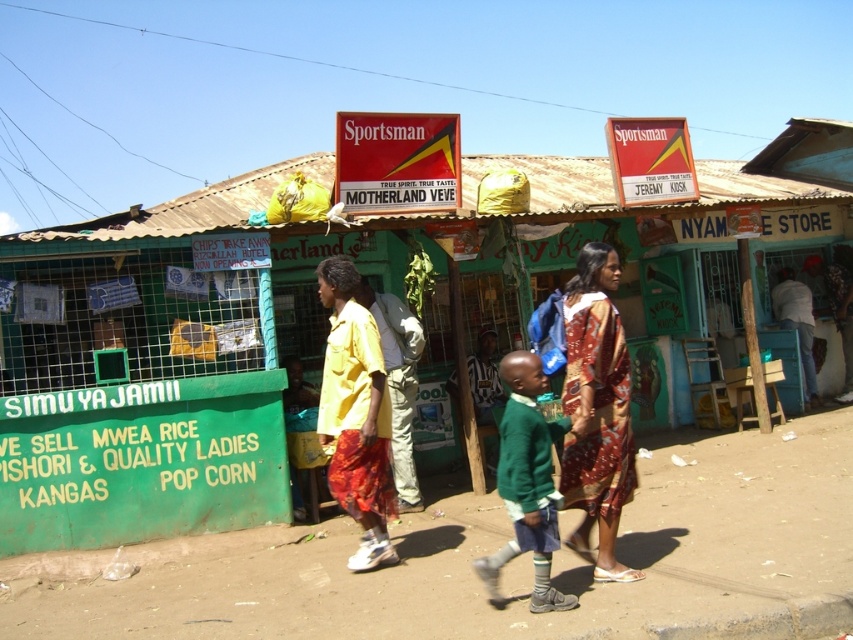
You are a photographer standing on the dirt road and want to take a photo of the printed silk dress at center and the green knitted sweater at center. Which object should you focus on first if you want to capture both in the same frame without moving the camera?

The printed silk dress at center is much taller than the green knitted sweater at center, so you should focus on the printed silk dress at center first to ensure it fits within the frame.

You are a photographer positioned on the dirt road. You want to take a photo of the green knitted sweater at center and the yellow fabric skirt at center. Which object should you focus on first to ensure both are in the frame?

The green knitted sweater at center is behind the yellow fabric skirt at center, so you should focus on the yellow fabric skirt at center first to ensure both are in the frame.

You are a tailor trying to fit a customer who prefers outfits with more fabric. Given the printed silk dress at center and the green knitted sweater at center, which item would you recommend based on the amount of fabric used?

The green knitted sweater at center has a greater width than the printed silk dress at center, indicating it uses more fabric. Therefore, the green knitted sweater at center would be the better recommendation for someone preferring outfits with more fabric.